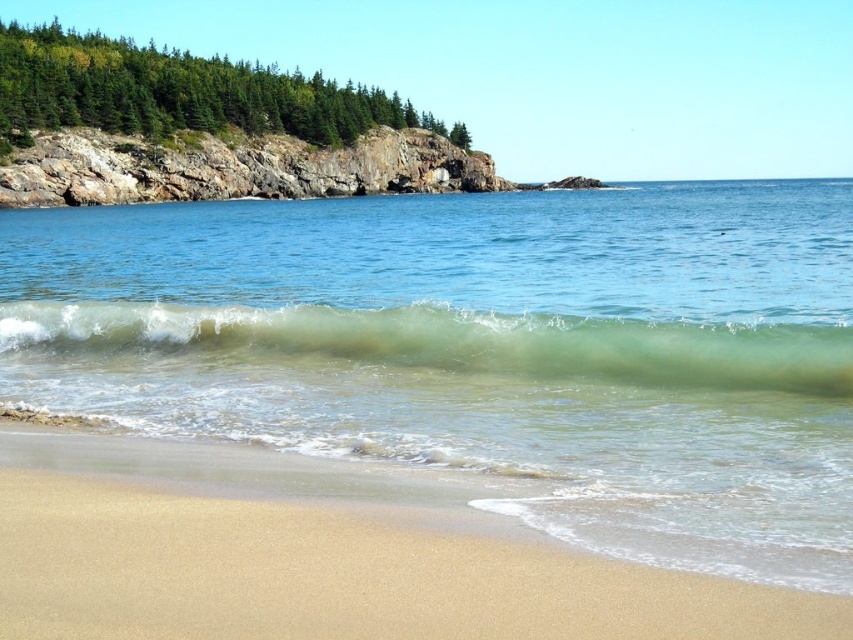
Question: Which of these objects is positioned closest to the clear water at center?

Choices:
 (A) green translucent wave at center
 (B) sandy beach at lower left

Answer: (A)

Question: Does clear water at center have a smaller size compared to green translucent wave at center?

Choices:
 (A) yes
 (B) no

Answer: (B)

Question: Can you confirm if clear water at center is bigger than green translucent wave at center?

Choices:
 (A) no
 (B) yes

Answer: (B)

Question: Does clear water at center appear on the right side of sandy beach at lower left?

Choices:
 (A) no
 (B) yes

Answer: (B)

Question: Which point is farther to the camera?

Choices:
 (A) (277, 600)
 (B) (71, 332)

Answer: (B)

Question: Estimate the real-world distances between objects in this image. Which object is farther from the clear water at center?

Choices:
 (A) sandy beach at lower left
 (B) green translucent wave at center

Answer: (A)